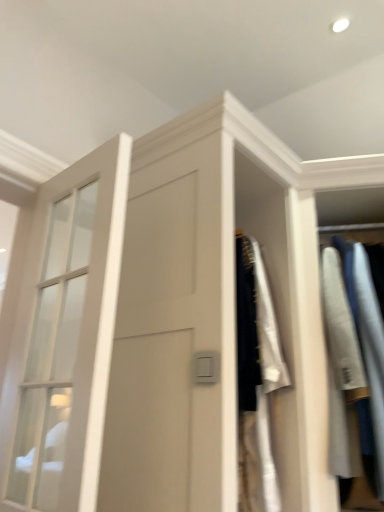
Question: From the image's perspective, is clear glass door at left above or below light gray cotton shirt at right?

Choices:
 (A) below
 (B) above

Answer: (B)

Question: Does point (74, 229) appear closer or farther from the camera than point (359, 393)?

Choices:
 (A) farther
 (B) closer

Answer: (A)

Question: Looking at the image, does clear glass door at left seem bigger or smaller compared to light gray cotton shirt at right?

Choices:
 (A) small
 (B) big

Answer: (A)

Question: Is light gray cotton shirt at right inside the boundaries of clear glass door at left, or outside?

Choices:
 (A) inside
 (B) outside

Answer: (B)

Question: Considering the positions of light gray cotton shirt at right and clear glass door at left in the image, is light gray cotton shirt at right taller or shorter than clear glass door at left?

Choices:
 (A) tall
 (B) short

Answer: (A)

Question: Relative to clear glass door at left, is light gray cotton shirt at right in front or behind?

Choices:
 (A) front
 (B) behind

Answer: (B)

Question: From the image's perspective, relative to clear glass door at left, is light gray cotton shirt at right above or below?

Choices:
 (A) below
 (B) above

Answer: (A)